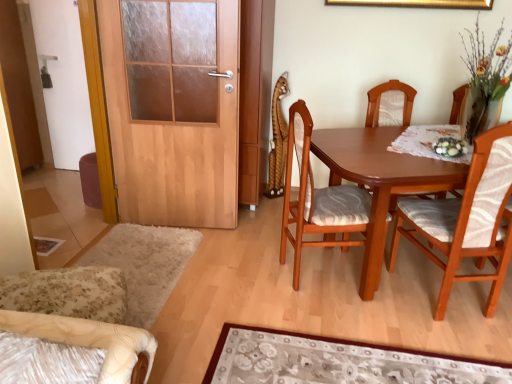
You are a GUI agent. You are given a task and a screenshot of the screen. Output one action in this format:
    pyautogui.click(x=<x>, y=<y>)
    Task: Click on the vacant area that is in front of wooden chair with patterned cushion at center, the second chair from the left
    This screenshot has width=512, height=384.
    Given the screenshot: What is the action you would take?
    (x=342, y=322)